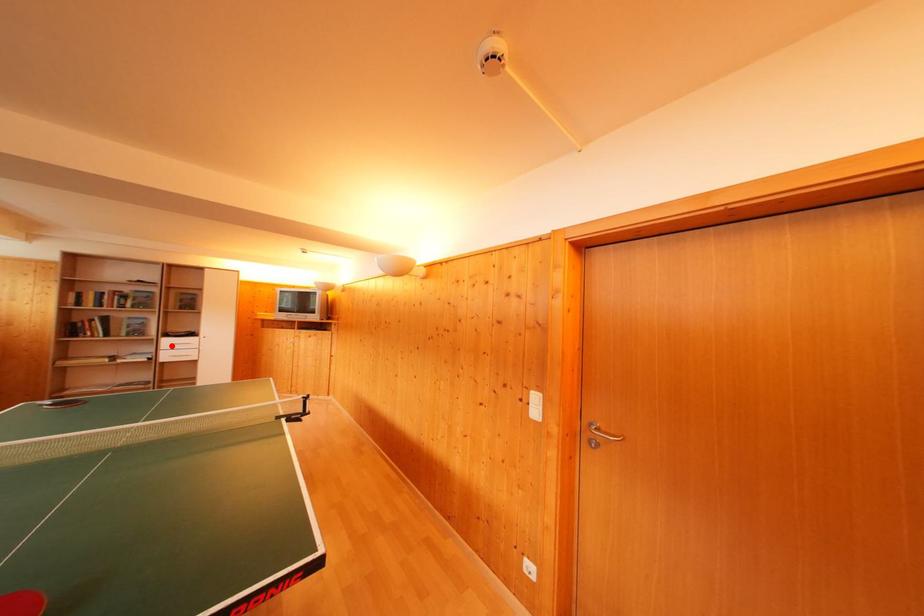
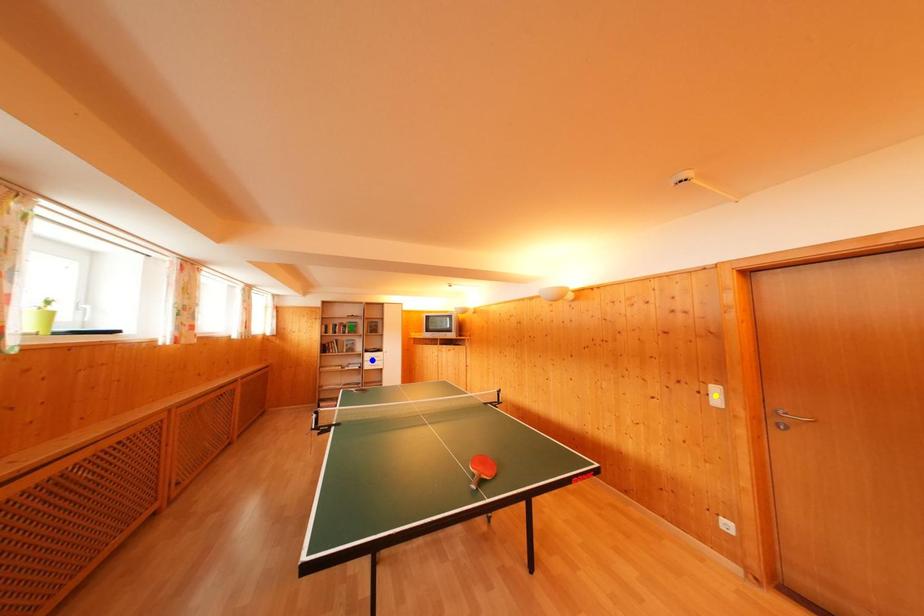
Question: I am providing you with two images of the same scene from different viewpoints. A red point is marked on the first image. You are given multiple points on the second image. Can you choose the point in image 2 that corresponds to the point in image 1?

Choices:
 (A) blue point
 (B) yellow point
 (C) green point

Answer: (A)